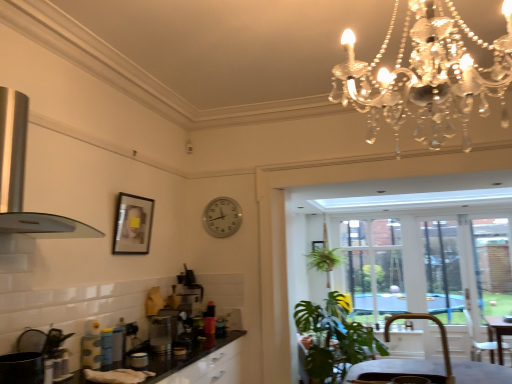
The height and width of the screenshot is (384, 512). I want to click on vacant area on top of satin silver toaster at center (from a real-world perspective), so click(162, 311).